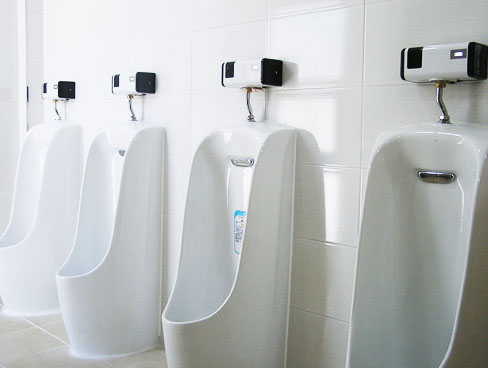
This screenshot has width=488, height=368. Find the location of `bathroom urninals`. bathroom urninals is located at coordinates (58, 169), (135, 185), (263, 205), (412, 218).